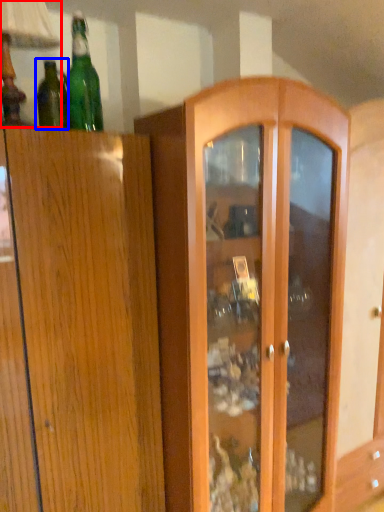
Question: Among these objects, which one is nearest to the camera, table lamp (highlighted by a red box) or bottle (highlighted by a blue box)?

Choices:
 (A) table lamp
 (B) bottle

Answer: (A)